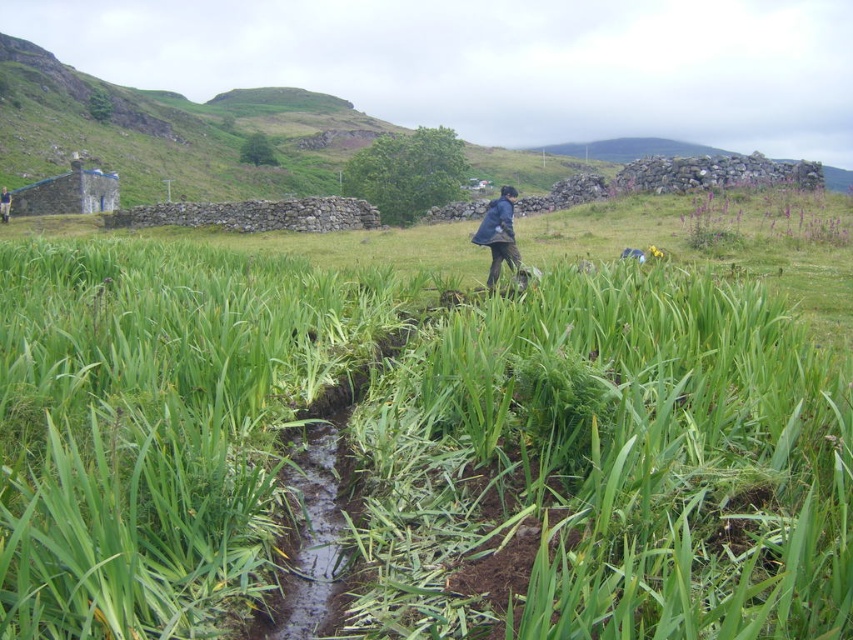
Between green grassy at center and blue fabric jacket at center, which one appears on the left side from the viewer's perspective?

→ green grassy at center

The width and height of the screenshot is (853, 640). Find the location of `green grassy at center`. green grassy at center is located at coordinates (608, 460).

Is point (24, 506) farther from viewer compared to point (492, 216)?

No, (24, 506) is in front of (492, 216).

This screenshot has width=853, height=640. Identify the location of green grassy at center. (608, 460).

Which is more to the left, green grassy at center or blue fabric at center?

Positioned to the left is blue fabric at center.

Who is more forward, (x=546, y=330) or (x=9, y=212)?

Point (x=546, y=330)

Locate an element on the screen. The width and height of the screenshot is (853, 640). green grassy at center is located at coordinates (608, 460).

Which of these two, blue fabric jacket at center or blue fabric at center, stands taller?

With more height is blue fabric jacket at center.

This screenshot has width=853, height=640. I want to click on blue fabric jacket at center, so click(x=498, y=234).

Where is `blue fabric jacket at center`? blue fabric jacket at center is located at coordinates (498, 234).